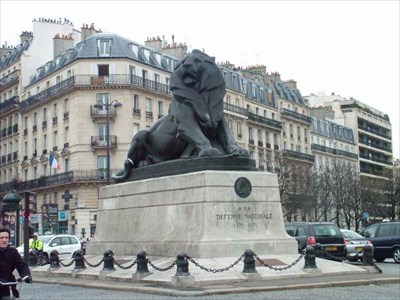
Locate an element on the screen. This screenshot has width=400, height=300. coat is located at coordinates (9, 260).